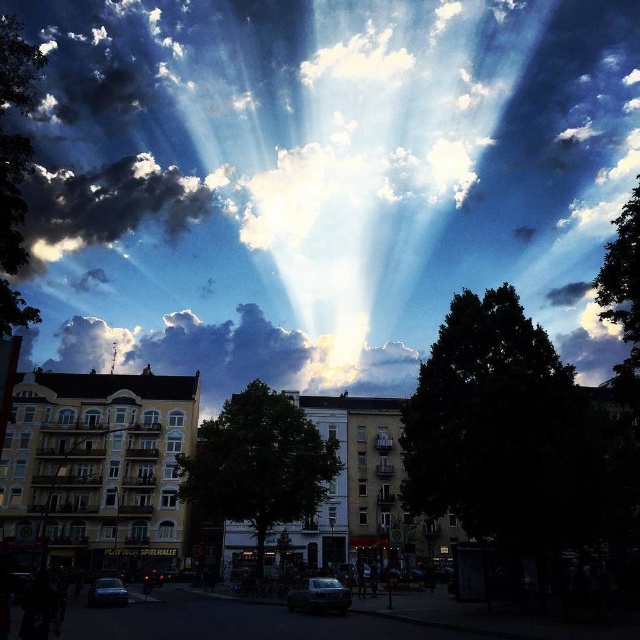
Between white fluffy cloud at upper center and dark fluffy cloud at upper left, which one is positioned higher?

white fluffy cloud at upper center is higher up.

Is white fluffy cloud at upper center positioned in front of dark fluffy cloud at upper left?

No.

Identify the location of white fluffy cloud at upper center. (321, 179).

Is dark green leafy tree at center wider than dark fluffy cloud at upper left?

In fact, dark green leafy tree at center might be narrower than dark fluffy cloud at upper left.

Find the location of a particular element. This screenshot has height=640, width=640. dark green leafy tree at center is located at coordinates (500, 432).

Locate an element on the screen. Image resolution: width=640 pixels, height=640 pixels. dark green leafy tree at center is located at coordinates (500, 432).

Does dark green leafy tree at center have a larger size compared to green leafy tree at left?

Incorrect, dark green leafy tree at center is not larger than green leafy tree at left.

Consider the image. Does dark green leafy tree at center appear on the right side of green leafy tree at left?

Yes, dark green leafy tree at center is to the right of green leafy tree at left.

Who is more distant from viewer, (486, 385) or (13, 29)?

Positioned behind is point (486, 385).

Find the location of a particular element. The image size is (640, 640). dark green leafy tree at center is located at coordinates (500, 432).